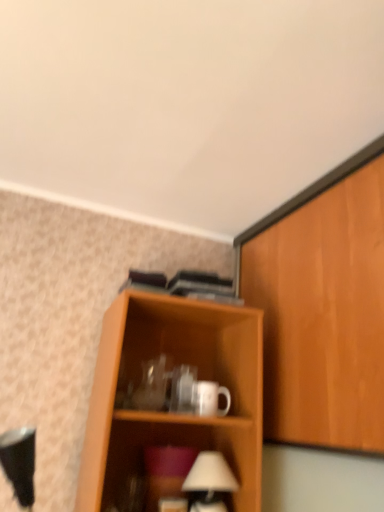
You are a GUI agent. You are given a task and a screenshot of the screen. Output one action in this format:
    pyautogui.click(x=<x>, y=<y>)
    Task: Click on the empty space that is ontop of wooden cabinet at right (from a real-world perspective)
    Image resolution: width=384 pixels, height=512 pixels.
    Given the screenshot: What is the action you would take?
    pyautogui.click(x=297, y=199)